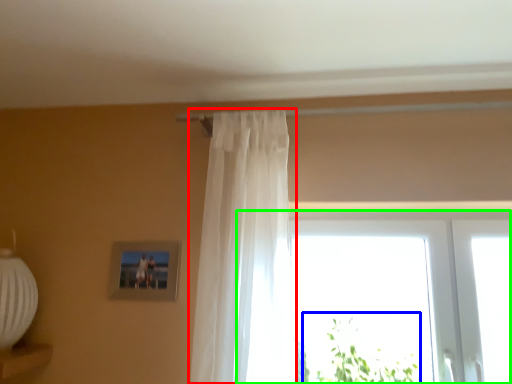
Question: Based on their relative distances, which object is farther from curtain (highlighted by a red box)? Choose from plant (highlighted by a blue box) and window (highlighted by a green box).

Choices:
 (A) plant
 (B) window

Answer: (A)